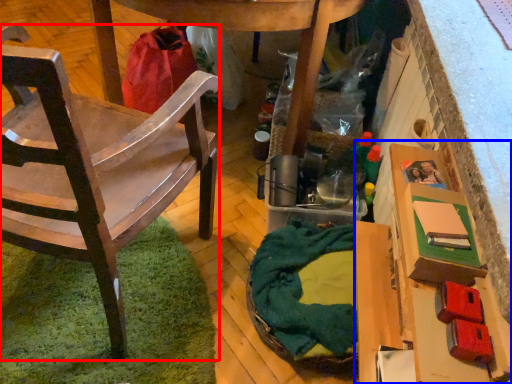
Question: Among these objects, which one is nearest to the camera, chair (highlighted by a red box) or cardboard box (highlighted by a blue box)?

Choices:
 (A) chair
 (B) cardboard box

Answer: (A)